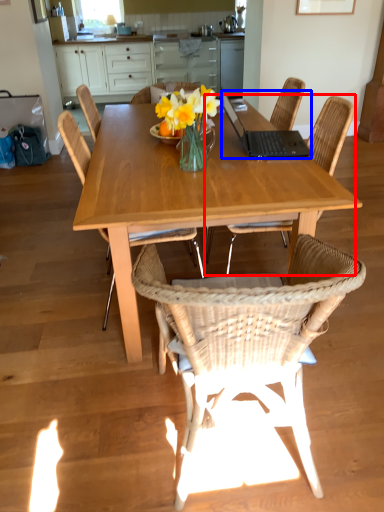
Question: Which object is closer to the camera taking this photo, chair (highlighted by a red box) or laptop (highlighted by a blue box)?

Choices:
 (A) chair
 (B) laptop

Answer: (A)